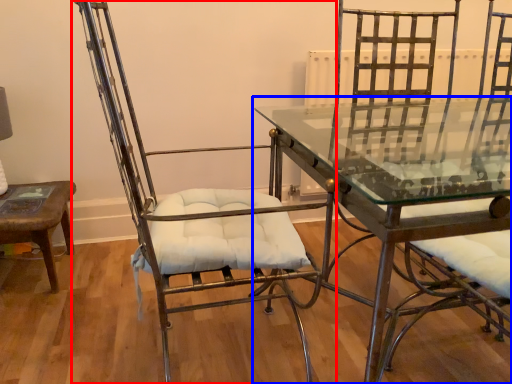
Question: Which object is closer to the camera taking this photo, chair (highlighted by a red box) or table (highlighted by a blue box)?

Choices:
 (A) chair
 (B) table

Answer: (B)